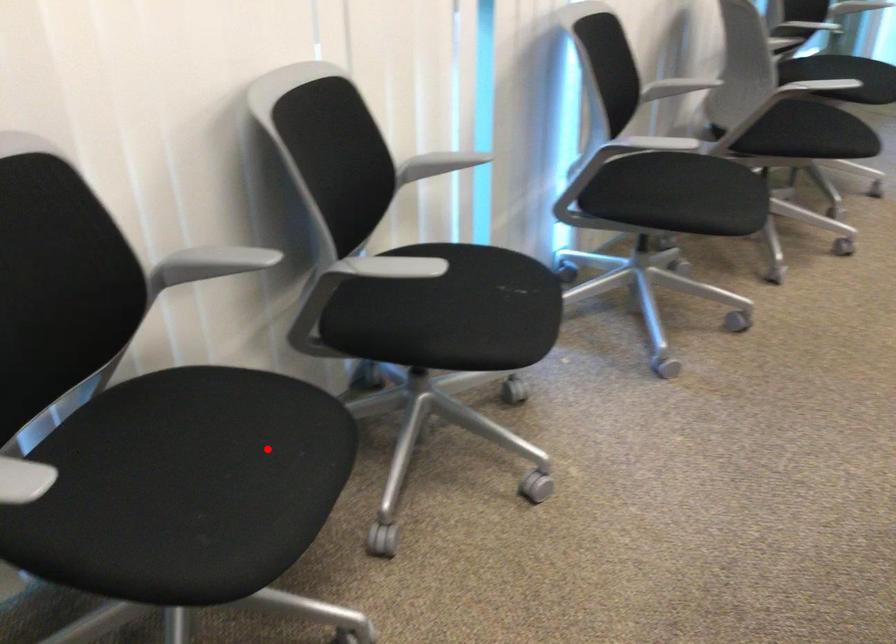
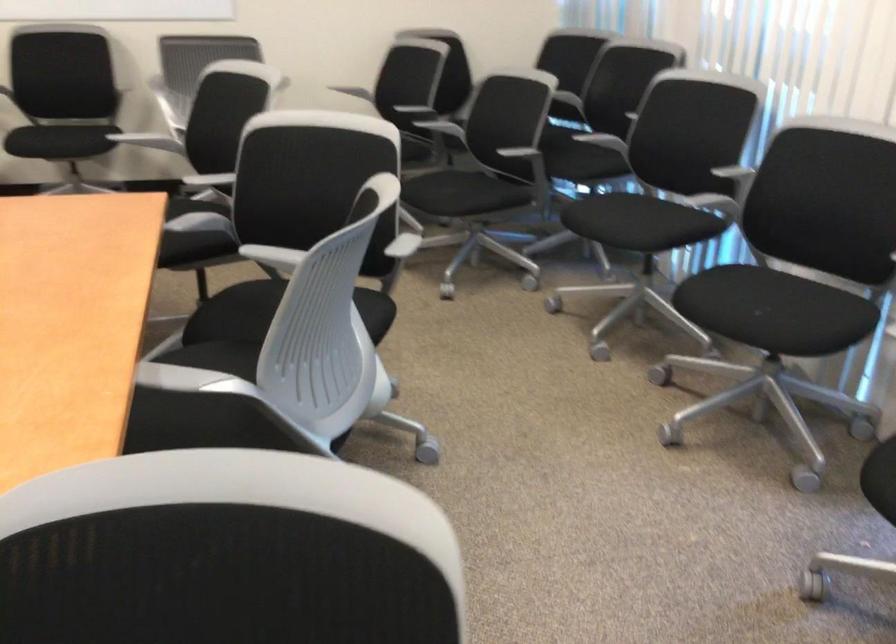
Question: I am providing you with two images of the same scene from different viewpoints. Given a red point in image1, look at the same physical point in image2. Is it:

Choices:
 (A) Closer to the viewpoint
 (B) Farther from the viewpoint

Answer: (B)